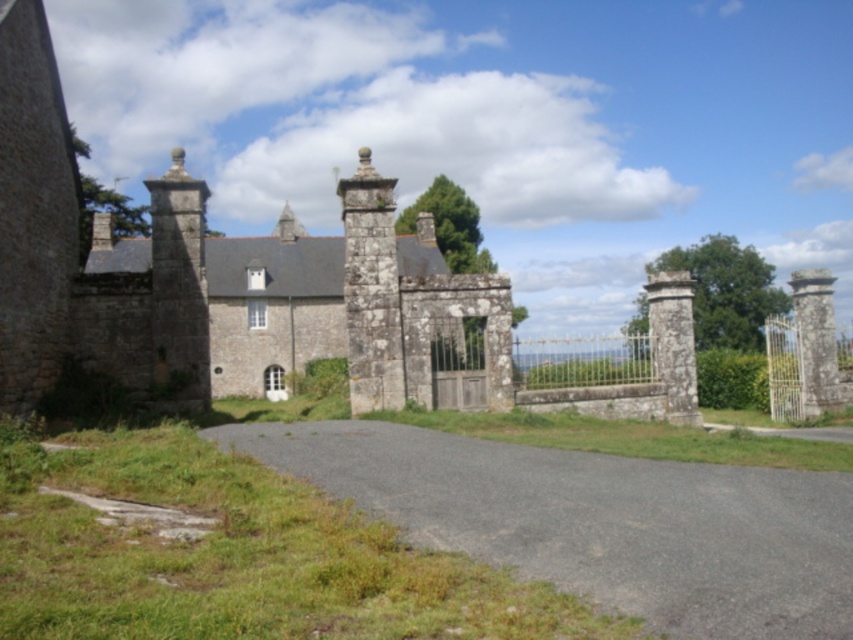
Between gray asphalt driveway at center and gray stone pillar at center, which one is positioned higher?

gray stone pillar at center is higher up.

Is point (274, 432) farther from camera compared to point (355, 202)?

That is False.

This screenshot has height=640, width=853. Identify the location of gray asphalt driveway at center. (598, 522).

Is gray stone pillar at center bigger than wooden gate at center?

Correct, gray stone pillar at center is larger in size than wooden gate at center.

Who is higher up, gray stone pillar at center or wooden gate at center?

gray stone pillar at center is above.

Who is more forward, [386,368] or [473,397]?

Point [386,368]

Locate an element on the screen. Image resolution: width=853 pixels, height=640 pixels. gray stone pillar at center is located at coordinates (370, 291).

Consider the image. Is gray stone pillar at center thinner than stone column at right?

Correct, gray stone pillar at center's width is less than stone column at right's.

Is gray stone pillar at center positioned in front of stone column at right?

Yes, it is.

What are the coordinates of `gray stone pillar at center` in the screenshot? It's located at (370, 291).

You are a GUI agent. You are given a task and a screenshot of the screen. Output one action in this format:
    pyautogui.click(x=<x>, y=<y>)
    Task: Click on the gray stone pillar at center
    Image resolution: width=853 pixels, height=640 pixels.
    Given the screenshot: What is the action you would take?
    pyautogui.click(x=370, y=291)